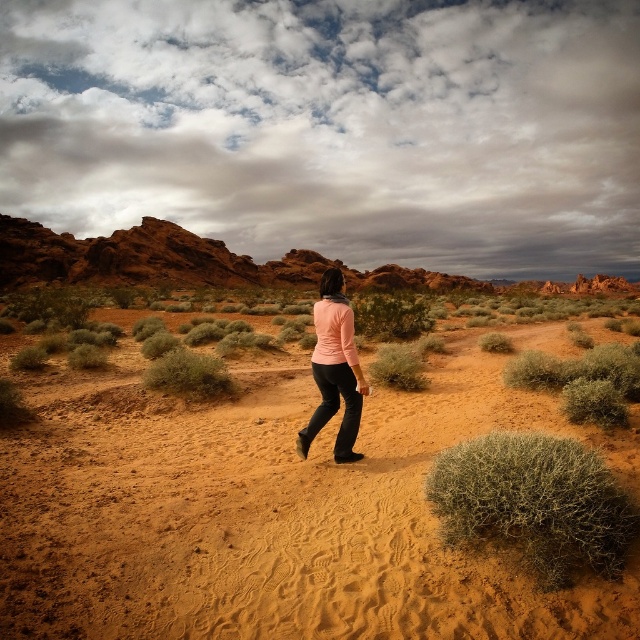
Question: Which point appears closest to the camera in this image?

Choices:
 (A) (51, 448)
 (B) (358, 380)

Answer: (B)

Question: Can you confirm if brown sandy dirt at center is thinner than matte pink sweater at center?

Choices:
 (A) yes
 (B) no

Answer: (B)

Question: Among these points, which one is farthest from the camera?

Choices:
 (A) (285, 394)
 (B) (360, 385)

Answer: (A)

Question: Can you confirm if brown sandy dirt at center is positioned below matte pink sweater at center?

Choices:
 (A) yes
 (B) no

Answer: (A)

Question: Is brown sandy dirt at center above matte pink sweater at center?

Choices:
 (A) no
 (B) yes

Answer: (A)